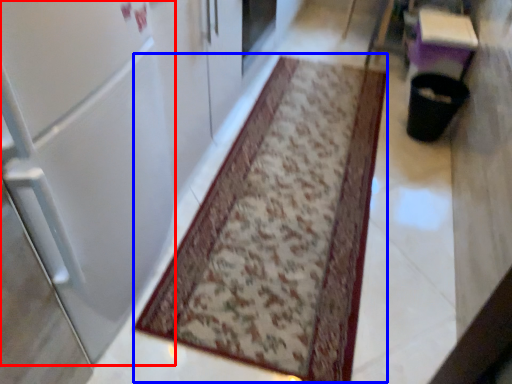
Question: Which object appears closest to the camera in this image, door (highlighted by a red box) or mat (highlighted by a blue box)?

Choices:
 (A) door
 (B) mat

Answer: (A)